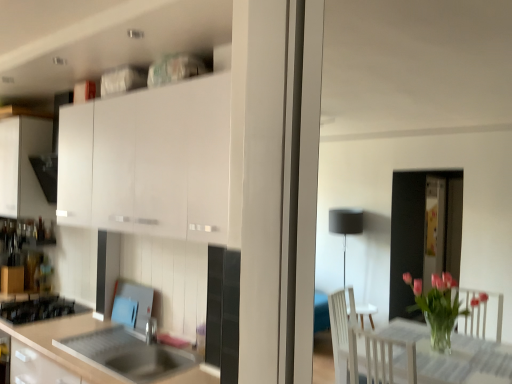
Question: Considering the positions of matte white cabinet at left, which appears as the second cabinetry when viewed from the right, and stainless steel sink at lower left in the image, is matte white cabinet at left, which appears as the second cabinetry when viewed from the right, wider or thinner than stainless steel sink at lower left?

Choices:
 (A) thin
 (B) wide

Answer: (B)

Question: From the image's perspective, relative to stainless steel sink at lower left, is matte white cabinet at left, which appears as the second cabinetry when viewed from the right, above or below?

Choices:
 (A) below
 (B) above

Answer: (B)

Question: Which of these objects is positioned farthest from the stainless steel sink at lower left?

Choices:
 (A) matte white cabinet at left, placed as the first cabinetry when sorted from left to right
 (B) black glass gas stove at lower left
 (C) white matte cabinet at upper left, placed as the first cabinetry when sorted from right to left

Answer: (A)

Question: Which of these objects is positioned farthest from the white matte cabinet at upper left, which ranks as the 2th cabinetry in left-to-right order?

Choices:
 (A) black glass gas stove at lower left
 (B) stainless steel sink at lower left
 (C) matte white cabinet at left, placed as the first cabinetry when sorted from left to right

Answer: (A)